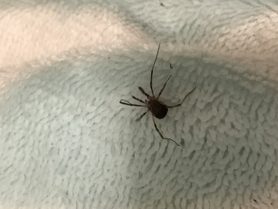
Image resolution: width=278 pixels, height=209 pixels. Find the location of `corner`. corner is located at coordinates (269, 203), (6, 203), (8, 14), (273, 5).